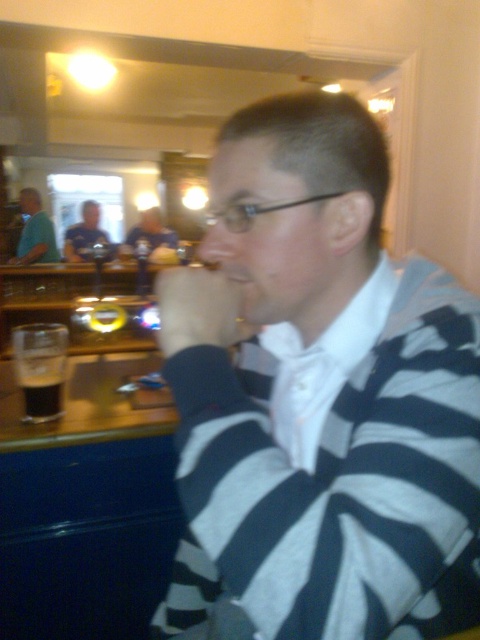
Question: In this image, where is striped sweater at center located relative to dark brown liquid at lower left?

Choices:
 (A) left
 (B) right

Answer: (B)

Question: Does matte green shirt at left have a larger size compared to matte black shirt at center?

Choices:
 (A) yes
 (B) no

Answer: (B)

Question: Which point appears closest to the camera in this image?

Choices:
 (A) (24, 381)
 (B) (248, 220)
 (C) (337, 381)
 (D) (79, 250)

Answer: (B)

Question: Where is dark matte glass at lower left located in relation to blue shirt at center in the image?

Choices:
 (A) left
 (B) right

Answer: (B)

Question: Which object is positioned farthest from the white striped shirt at center?

Choices:
 (A) dark matte glass at lower left
 (B) matte green shirt at left
 (C) dark brown liquid at lower left
 (D) striped sweater at center

Answer: (B)

Question: Which is farther from the dark matte glass at lower left?

Choices:
 (A) white striped shirt at center
 (B) dark brown liquid at lower left
 (C) blue shirt at center

Answer: (C)